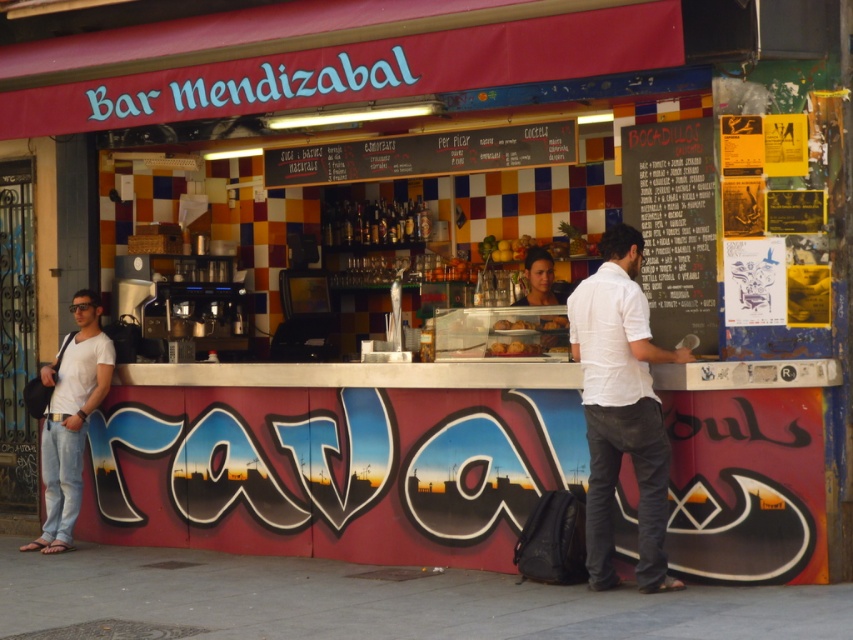
Question: Is white matte t-shirt at left wider than matte black face at center?

Choices:
 (A) yes
 (B) no

Answer: (A)

Question: Among these points, which one is nearest to the camera?

Choices:
 (A) (647, 368)
 (B) (541, 259)

Answer: (A)

Question: Which of these objects is positioned farthest from the white cotton shirt at center?

Choices:
 (A) black chalkboard menu at center
 (B) matte black face at center

Answer: (B)

Question: Among these objects, which one is nearest to the camera?

Choices:
 (A) white cotton shirt at center
 (B) matte black face at center
 (C) golden brown pastry at center

Answer: (A)

Question: From the image, what is the correct spatial relationship of black chalkboard menu at center in relation to matte black face at center?

Choices:
 (A) left
 (B) right

Answer: (B)

Question: Can you confirm if black chalkboard menu at center is wider than golden brown pastry at center?

Choices:
 (A) no
 (B) yes

Answer: (B)